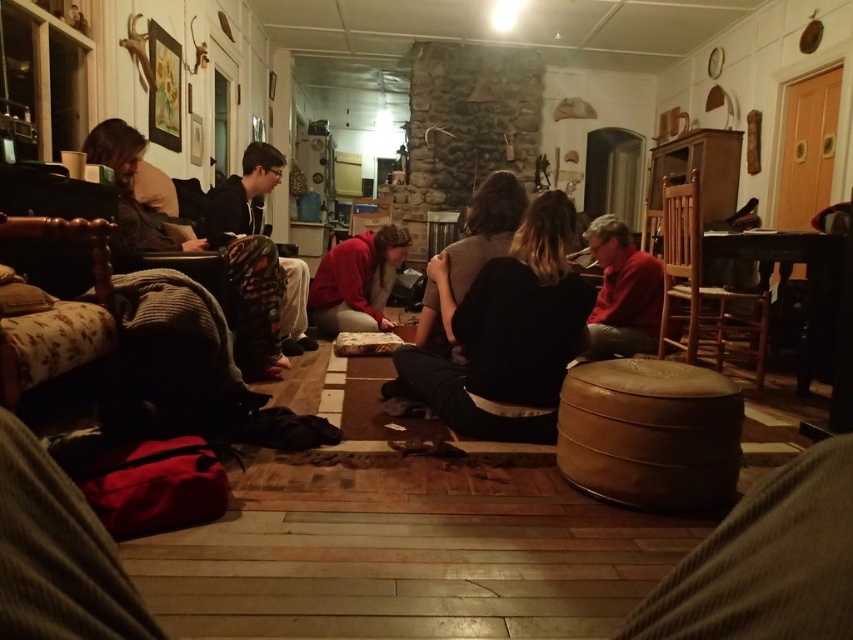
Question: Estimate the real-world distances between objects in this image. Which object is closer to the leather ottoman at center?

Choices:
 (A) red hoodie at center
 (B) red matte sweater at right
 (C) floral fabric armchair at left
 (D) black fabric at center

Answer: (D)

Question: Which point is farther to the camera?

Choices:
 (A) red hoodie at center
 (B) camouflage pants at left
 (C) black hoodie at center
 (D) wooden chair at right

Answer: (A)

Question: Is black leather jacket at center positioned before floral fabric armchair at left?

Choices:
 (A) no
 (B) yes

Answer: (A)

Question: Can you confirm if red matte sweater at right is bigger than red hoodie at center?

Choices:
 (A) no
 (B) yes

Answer: (A)

Question: Among these points, which one is farthest from the camera?

Choices:
 (A) (22, 342)
 (B) (672, 403)
 (C) (619, 314)
 (D) (273, 250)

Answer: (C)

Question: Is wooden chair at right closer to camera compared to black hoodie at center?

Choices:
 (A) yes
 (B) no

Answer: (B)